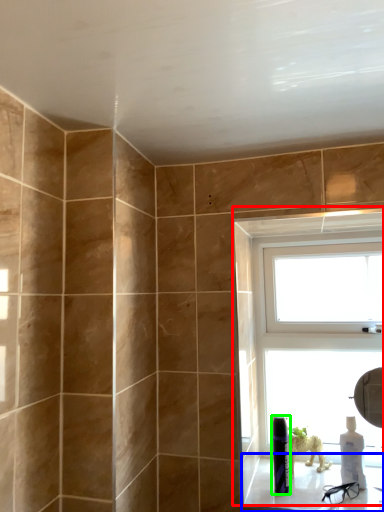
Question: Which object is the farthest from window (highlighted by a red box)? Choose among these: window sill (highlighted by a blue box) or toiletry (highlighted by a green box).

Choices:
 (A) window sill
 (B) toiletry

Answer: (B)